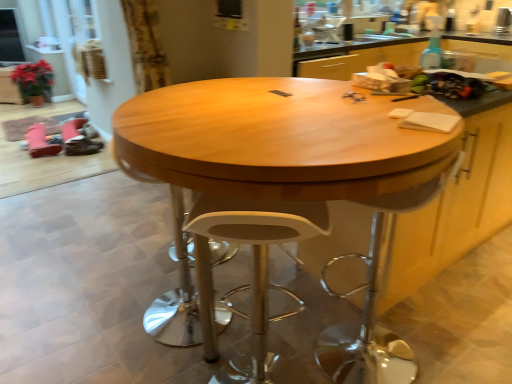
Identify the location of wooden cabinet at center, marked as the first cabinetry in a right-to-left arrangement. The image size is (512, 384). (458, 203).

This screenshot has width=512, height=384. Describe the element at coordinates (458, 203) in the screenshot. I see `wooden cabinet at center, marked as the first cabinetry in a right-to-left arrangement` at that location.

Find the location of a particular element. wooden table at center is located at coordinates (275, 173).

I want to click on green matte plant at left, marked as the second cabinetry in a right-to-left arrangement, so click(9, 87).

In terms of height, does wooden table at center look taller or shorter compared to white plastic swivel chair at center?

Considering their sizes, wooden table at center has more height than white plastic swivel chair at center.

Considering the positions of objects wooden table at center and white plastic swivel chair at center in the image provided, who is more to the left, wooden table at center or white plastic swivel chair at center?

wooden table at center is more to the left.

Identify the location of table above the white plastic swivel chair at center (from a real-world perspective). (275, 173).

Is wooden table at center next to white plastic swivel chair at center and touching it?

No, wooden table at center is not in contact with white plastic swivel chair at center.

Is point (479, 190) less distant than point (224, 300)?

No, (479, 190) is behind (224, 300).

Does wooden cabinet at center, which is the second cabinetry from back to front, turn towards white plastic stool at center?

No, wooden cabinet at center, which is the second cabinetry from back to front, is not aimed at white plastic stool at center.

At what (x,y) coordinates should I click in order to perform the action: click on stool located underneath the wooden cabinet at center, the first cabinetry in the bottom-to-top sequence (from a real-world perspective). Please return your answer as a coordinate pair (x, y). The image size is (512, 384). Looking at the image, I should click on (252, 270).

Is wooden cabinet at center, marked as the first cabinetry in a right-to-left arrangement, situated inside white plastic stool at center or outside?

wooden cabinet at center, marked as the first cabinetry in a right-to-left arrangement, exists outside the volume of white plastic stool at center.

Which object is more forward, white plastic stool at center or wooden cabinet at center, which appears as the first cabinetry when viewed from the front?

white plastic stool at center is more forward.

Considering the sizes of white plastic stool at center and wooden cabinet at center, the first cabinetry in the bottom-to-top sequence, in the image, is white plastic stool at center bigger or smaller than wooden cabinet at center, the first cabinetry in the bottom-to-top sequence,?

Considering their sizes, white plastic stool at center takes up less space than wooden cabinet at center, the first cabinetry in the bottom-to-top sequence.

Is white plastic stool at center turned away from wooden cabinet at center, positioned as the second cabinetry in left-to-right order?

white plastic stool at center does not have its back to wooden cabinet at center, positioned as the second cabinetry in left-to-right order.

Is white plastic stool at center thinner than wooden cabinet at center, positioned as the second cabinetry in left-to-right order?

Indeed, white plastic stool at center has a lesser width compared to wooden cabinet at center, positioned as the second cabinetry in left-to-right order.

Which of these two, white plastic swivel chair at center or white plastic stool at center, is smaller?

Smaller between the two is white plastic stool at center.

Which is behind, point (432, 199) or point (209, 232)?

The point (432, 199) is farther from the camera.

Is white plastic swivel chair at center facing away from white plastic stool at center?

No, white plastic swivel chair at center is not facing away from white plastic stool at center.

Is wooden table at center inside the boundaries of white plastic stool at center, or outside?

wooden table at center lies outside white plastic stool at center.

Between wooden table at center and white plastic stool at center, which one has larger size?

wooden table at center.

Is point (279, 195) closer or farther from the camera than point (273, 222)?

Clearly, point (279, 195) is closer to the camera than point (273, 222).

From the image's perspective, is wooden table at center located beneath white plastic stool at center?

No, from the image's perspective, wooden table at center is not beneath white plastic stool at center.

Is white plastic stool at center oriented away from wooden table at center?

Absolutely, white plastic stool at center is directed away from wooden table at center.

Considering the relative sizes of white plastic stool at center and wooden table at center in the image provided, is white plastic stool at center wider than wooden table at center?

No, white plastic stool at center is not wider than wooden table at center.

From a real-world perspective, relative to wooden table at center, is white plastic stool at center vertically above or below?

white plastic stool at center is below wooden table at center.

Can you see white plastic swivel chair at center touching wooden cabinet at center, positioned as the second cabinetry in left-to-right order?

No, white plastic swivel chair at center is not making contact with wooden cabinet at center, positioned as the second cabinetry in left-to-right order.

You are a GUI agent. You are given a task and a screenshot of the screen. Output one action in this format:
    pyautogui.click(x=<x>, y=<y>)
    Task: Click on the cabinetry that appears above the white plastic swivel chair at center (from a real-world perspective)
    The height and width of the screenshot is (384, 512).
    Given the screenshot: What is the action you would take?
    pyautogui.click(x=458, y=203)

How many degrees apart are the facing directions of white plastic swivel chair at center and wooden cabinet at center, the first cabinetry in the bottom-to-top sequence?

white plastic swivel chair at center and wooden cabinet at center, the first cabinetry in the bottom-to-top sequence, are facing 21.2 degrees away from each other.

In the scene shown: Considering the relative positions of white plastic swivel chair at center and wooden cabinet at center, marked as the first cabinetry in a right-to-left arrangement, in the image provided, is white plastic swivel chair at center to the left or to the right of wooden cabinet at center, marked as the first cabinetry in a right-to-left arrangement,?

From the image, it's evident that white plastic swivel chair at center is to the left of wooden cabinet at center, marked as the first cabinetry in a right-to-left arrangement.

What are the coordinates of `swivel chair that is under the wooden table at center (from a real-world perspective)` in the screenshot? It's located at (375, 298).

Locate an element on the screen. stool below the wooden cabinet at center, positioned as the second cabinetry in left-to-right order (from the image's perspective) is located at coordinates (252, 270).

From the image, which object appears to be farther from white plastic stool at center, green matte plant at left, which ranks as the 1th cabinetry in back-to-front order, or white plastic swivel chair at center?

green matte plant at left, which ranks as the 1th cabinetry in back-to-front order, is positioned further to the anchor white plastic stool at center.

Which object lies further to the anchor point white plastic stool at center, wooden cabinet at center, marked as the first cabinetry in a right-to-left arrangement, or green matte plant at left, the 1th cabinetry in the left-to-right sequence?

Based on the image, green matte plant at left, the 1th cabinetry in the left-to-right sequence, appears to be further to white plastic stool at center.

When comparing their distances from white plastic swivel chair at center, does green matte plant at left, marked as the second cabinetry in a right-to-left arrangement, or wooden cabinet at center, which appears as the first cabinetry when viewed from the front, seem closer?

Based on the image, wooden cabinet at center, which appears as the first cabinetry when viewed from the front, appears to be nearer to white plastic swivel chair at center.

When comparing their distances from wooden table at center, does wooden cabinet at center, which appears as the first cabinetry when viewed from the front, or white plastic stool at center seem closer?

Based on the image, white plastic stool at center appears to be nearer to wooden table at center.

Estimate the real-world distances between objects in this image. Which object is closer to green matte plant at left, the 1th cabinetry viewed from the top, wooden cabinet at center, positioned as the second cabinetry in left-to-right order, or white plastic swivel chair at center?

The object closer to green matte plant at left, the 1th cabinetry viewed from the top, is white plastic swivel chair at center.

From the image, which object appears to be farther from white plastic stool at center, wooden table at center or green matte plant at left, the 2th cabinetry when ordered from front to back?

The object further to white plastic stool at center is green matte plant at left, the 2th cabinetry when ordered from front to back.

Based on their spatial positions, is white plastic stool at center or wooden cabinet at center, the first cabinetry in the bottom-to-top sequence, further from green matte plant at left, which ranks as the 1th cabinetry in back-to-front order?

wooden cabinet at center, the first cabinetry in the bottom-to-top sequence, is further to green matte plant at left, which ranks as the 1th cabinetry in back-to-front order.

Estimate the real-world distances between objects in this image. Which object is further from white plastic stool at center, green matte plant at left, which ranks as the 1th cabinetry in back-to-front order, or wooden cabinet at center, which appears as the first cabinetry when viewed from the front?

The object further to white plastic stool at center is green matte plant at left, which ranks as the 1th cabinetry in back-to-front order.

You are a GUI agent. You are given a task and a screenshot of the screen. Output one action in this format:
    pyautogui.click(x=<x>, y=<y>)
    Task: Click on the cabinetry located between wooden table at center and green matte plant at left, the 1th cabinetry viewed from the top, in the depth direction
    
    Given the screenshot: What is the action you would take?
    pyautogui.click(x=458, y=203)

This screenshot has width=512, height=384. Identify the location of table situated between white plastic stool at center and wooden cabinet at center, positioned as the second cabinetry in left-to-right order, from left to right. click(275, 173).

Where is `cabinetry positioned between white plastic stool at center and green matte plant at left, the second cabinetry positioned from the bottom, from near to far`? This screenshot has height=384, width=512. cabinetry positioned between white plastic stool at center and green matte plant at left, the second cabinetry positioned from the bottom, from near to far is located at coordinates (458, 203).

You are a GUI agent. You are given a task and a screenshot of the screen. Output one action in this format:
    pyautogui.click(x=<x>, y=<y>)
    Task: Click on the swivel chair between wooden table at center and green matte plant at left, the 2th cabinetry when ordered from front to back, from front to back
    Image resolution: width=512 pixels, height=384 pixels.
    Given the screenshot: What is the action you would take?
    375,298